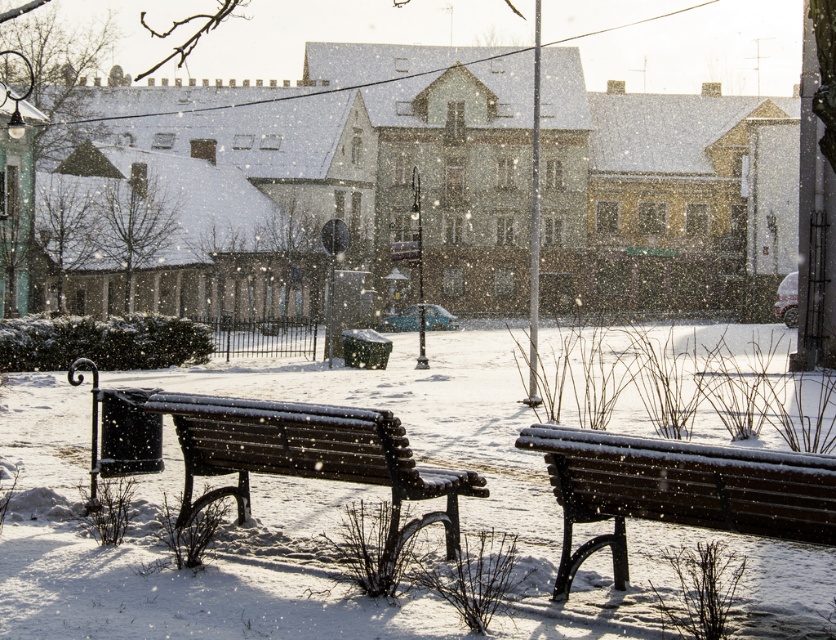
Which of these two, wooden bench at right or wooden bench at center, stands taller?

Standing taller between the two is wooden bench at center.

Is point (546, 456) less distant than point (408, 492)?

Yes.

The width and height of the screenshot is (836, 640). What do you see at coordinates (678, 490) in the screenshot?
I see `wooden bench at right` at bounding box center [678, 490].

Identify the location of wooden bench at right. (678, 490).